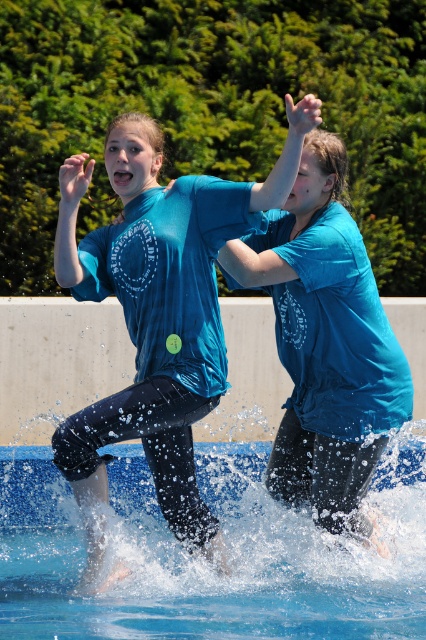
You are standing at the edge of the scene and want to walk towards the blue rubber swimming pool at lower center. Which direction should you move relative to the matte blue shirt at center?

The blue rubber swimming pool at lower center is to the left of the matte blue shirt at center, so you should move to the left relative to the matte blue shirt at center to reach it.

You are standing at the origin point in the image. There is a point labeled as point (160, 305) in the image. What object is located at this point?

The point (160, 305) corresponds to the location of the matte blue tshirt at center.